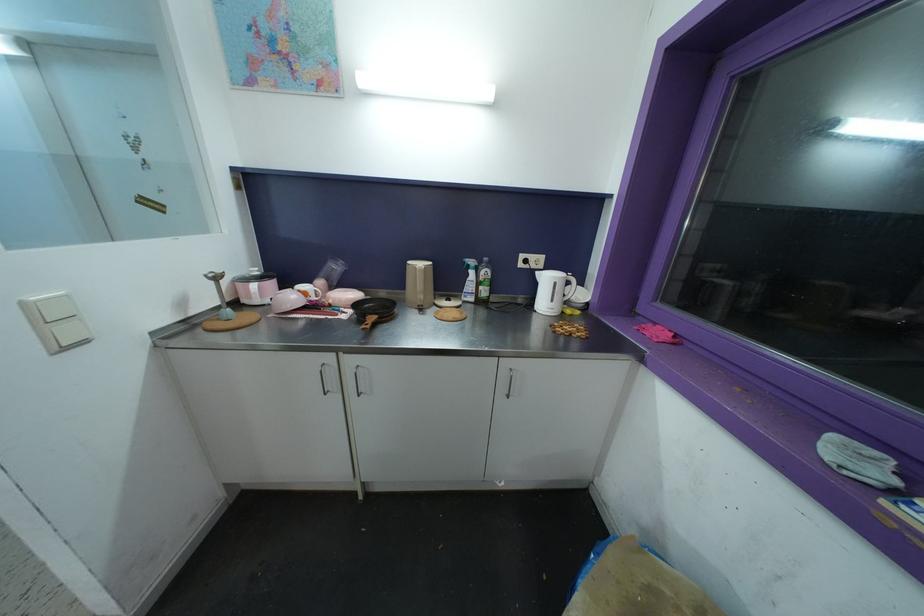
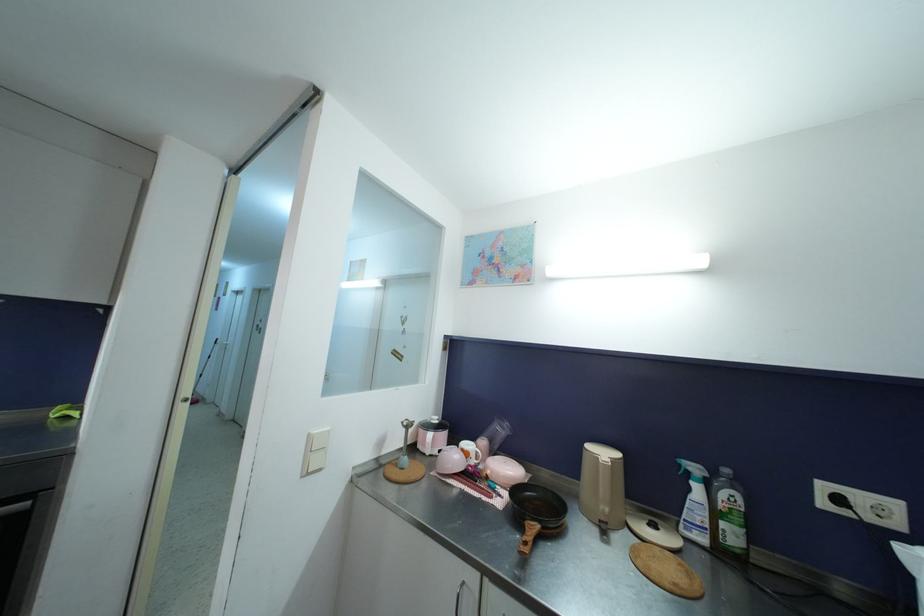
Locate, in the second image, the point that corresponds to point 475,265 in the first image.

(699, 472)